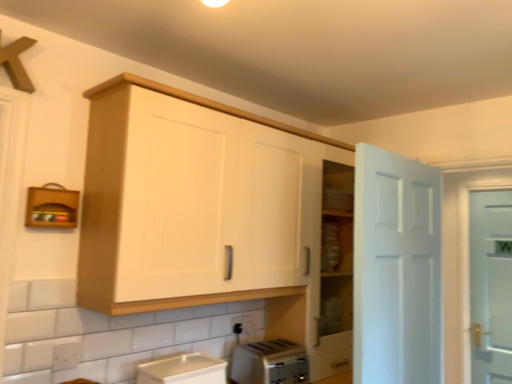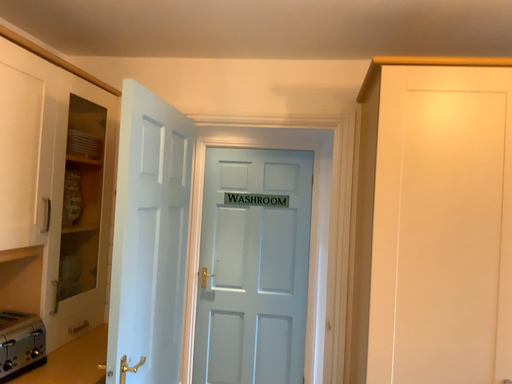
Question: How did the camera likely rotate when shooting the video?

Choices:
 (A) rotated right
 (B) rotated left

Answer: (A)